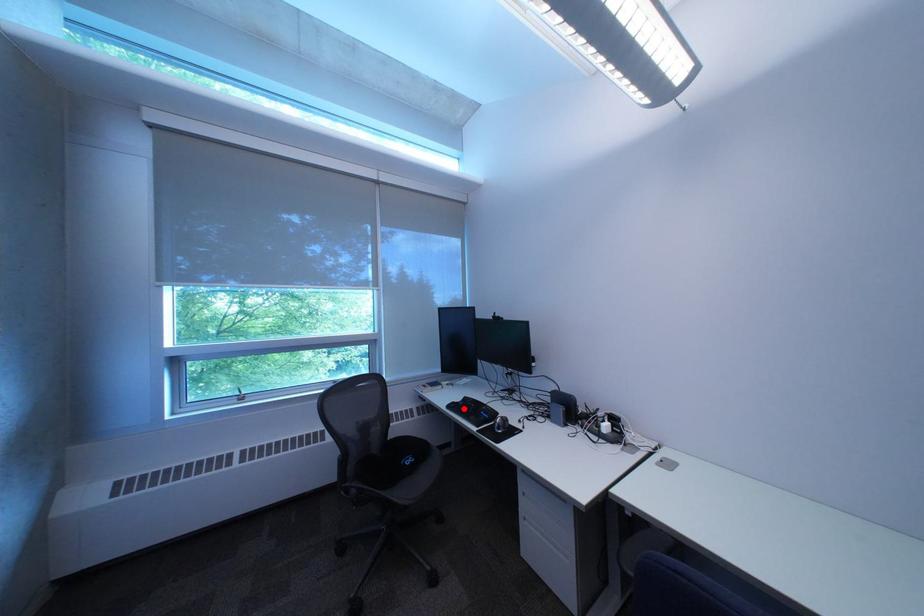
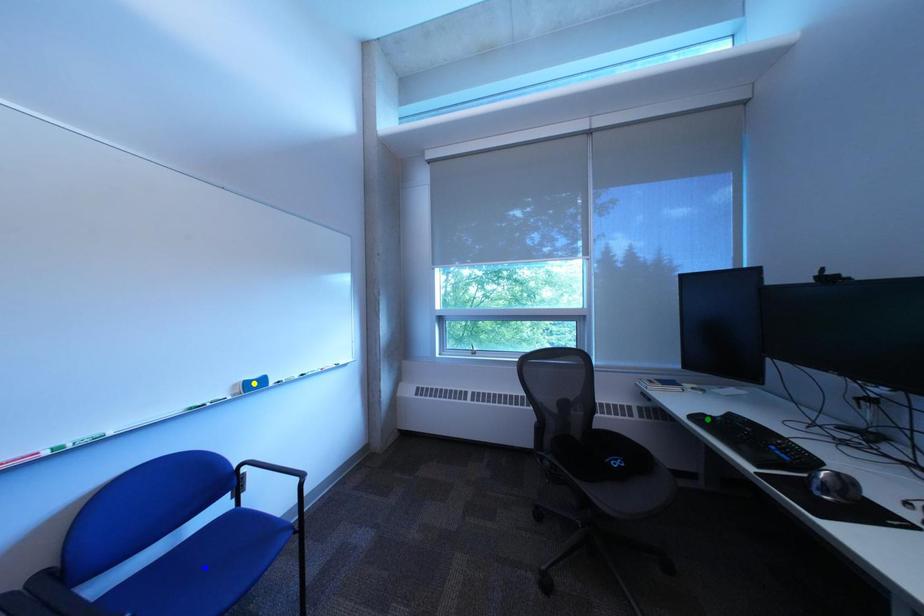
Question: I am providing you with two images of the same scene from different viewpoints. A red point is marked on the first image. You are given multiple points on the second image. Which point in image 2 represents the same 3d spot as the red point in image 1?

Choices:
 (A) yellow point
 (B) blue point
 (C) green point

Answer: (C)